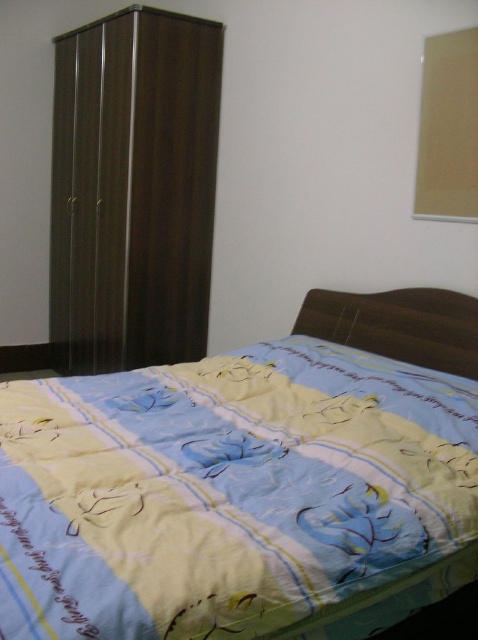
You are trying to decide whether to place a new painting above the dark wood wardrobe at left or on the wall next to the yellow printed fabric bed at lower left. Based on the height of the objects, which location would be more suitable for the painting?

The dark wood wardrobe at left is much taller than the yellow printed fabric bed at lower left, so placing the painting above the dark wood wardrobe at left would be more suitable as it can accommodate the height better.